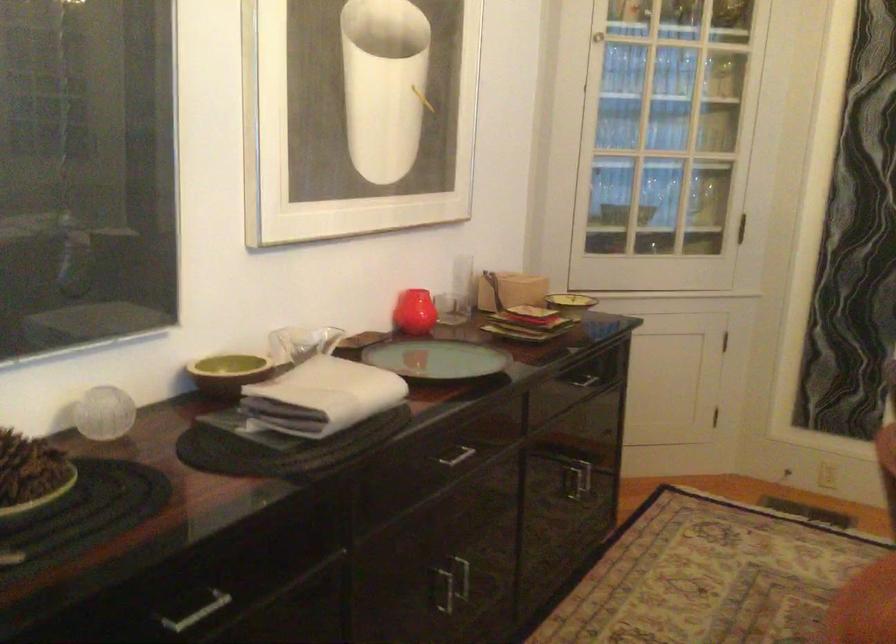
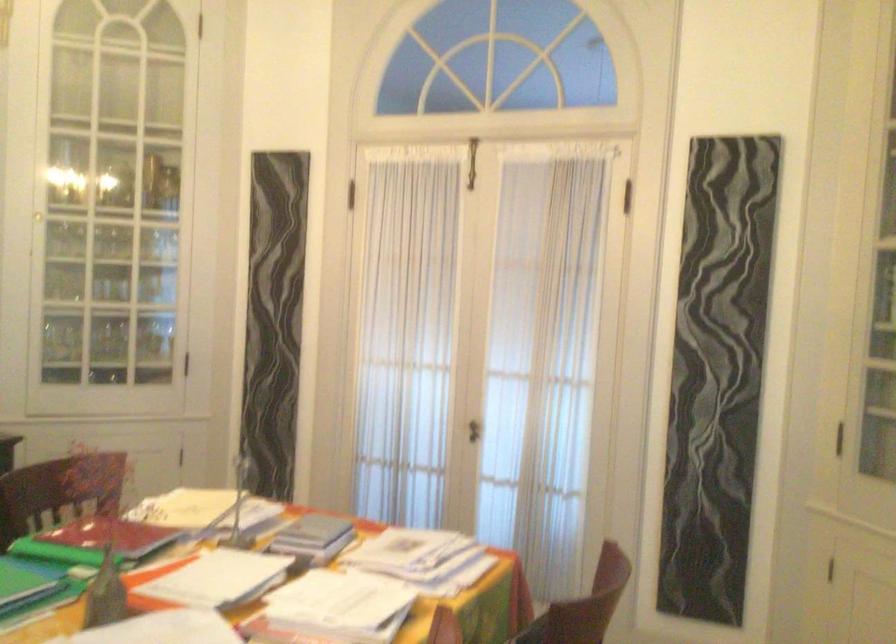
The images are taken continuously from a first-person perspective. In which direction are you moving?

The cameraman moved toward right, backward.